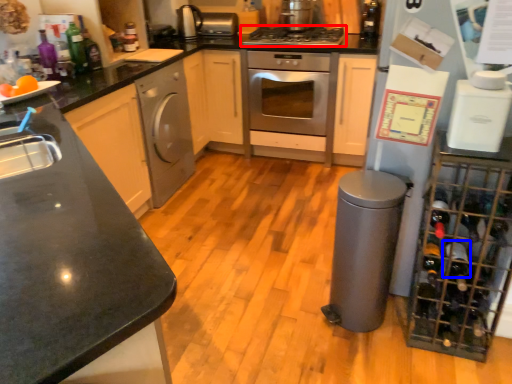
Question: Which object is further to the camera taking this photo, gas stove (highlighted by a red box) or wine bottle (highlighted by a blue box)?

Choices:
 (A) gas stove
 (B) wine bottle

Answer: (A)